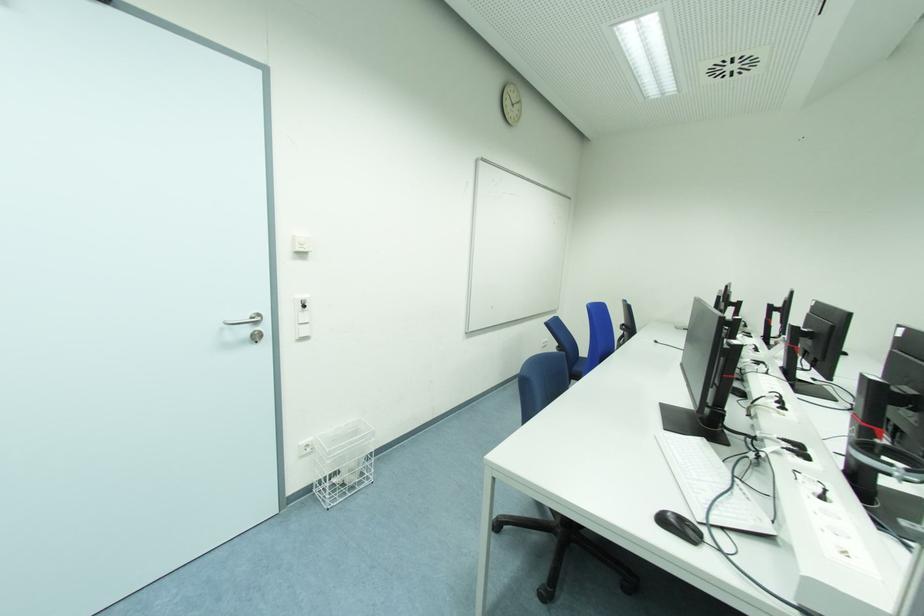
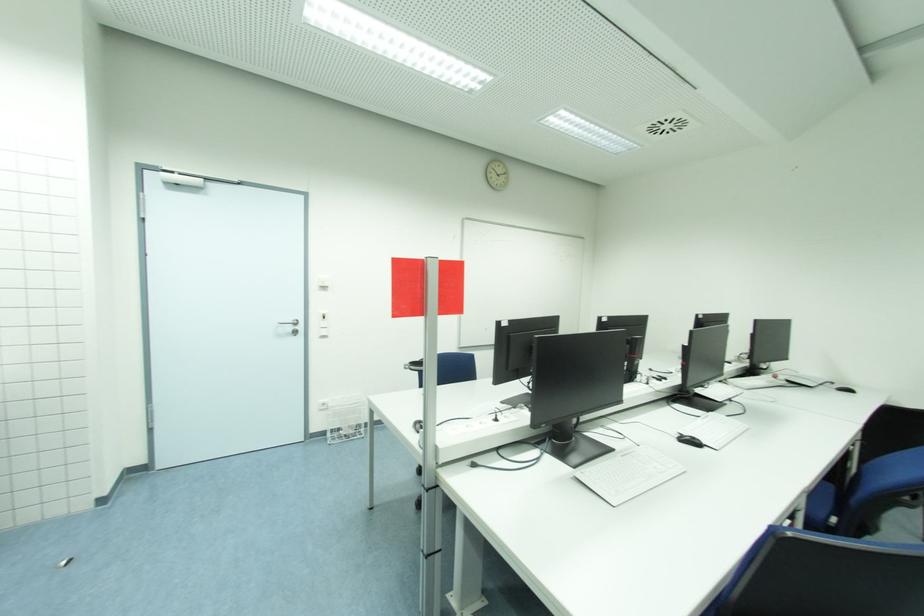
In a continuous first-person perspective shot, in which direction is the camera moving?

The cameraman moved toward right, backward.